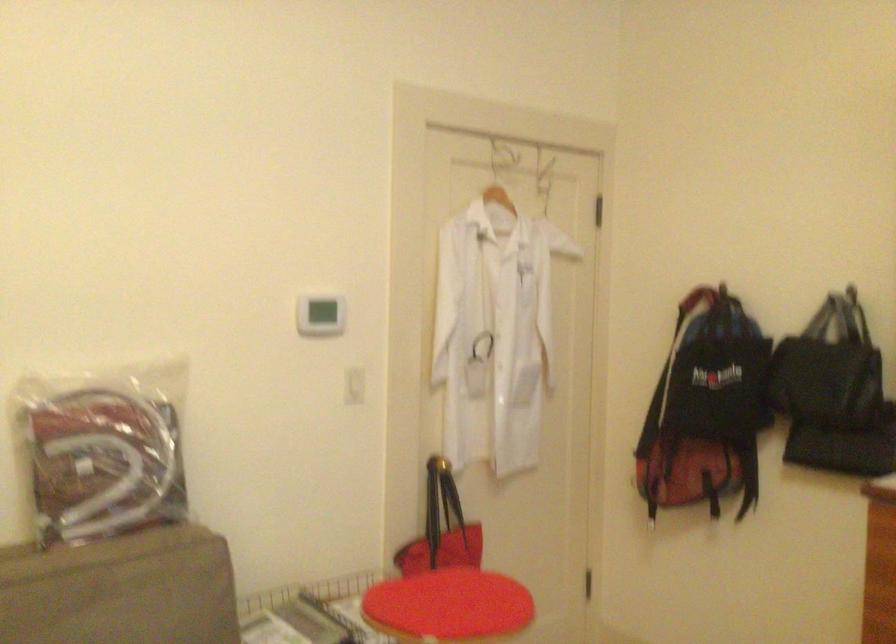
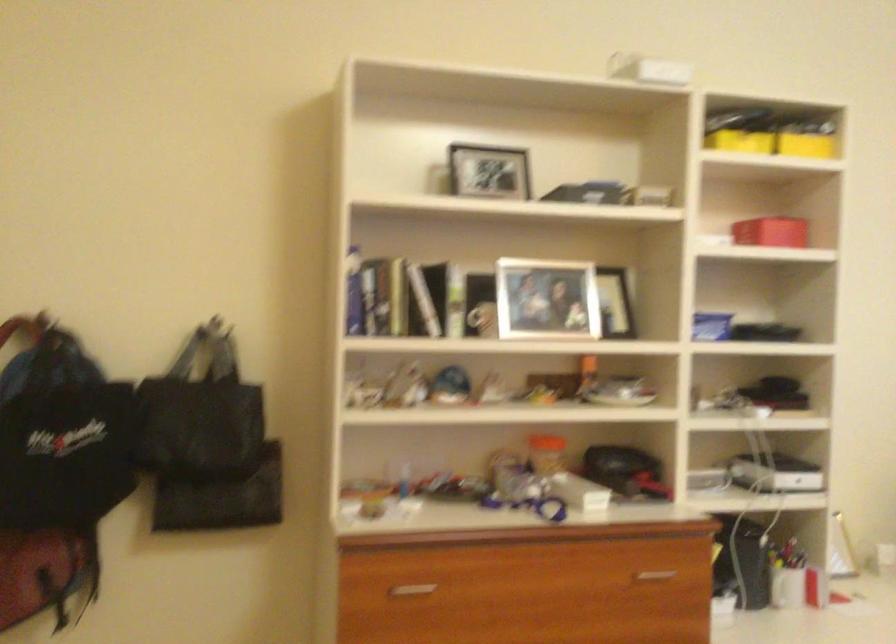
Question: The camera is either moving clockwise (left) or counter-clockwise (right) around the object. The first image is from the beginning of the video and the second image is from the end. Is the camera moving left or right when shooting the video?

Choices:
 (A) Left
 (B) Right

Answer: (A)